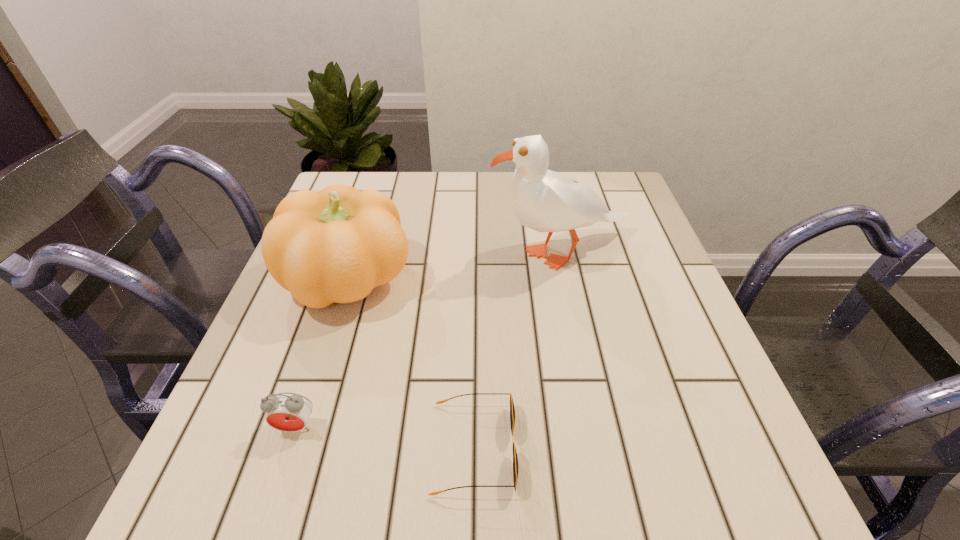
Where is `pumpkin situated at the left edge`? The width and height of the screenshot is (960, 540). pumpkin situated at the left edge is located at coordinates (336, 245).

Identify the location of alarm clock that is at the left edge. (289, 412).

The image size is (960, 540). Find the location of `object located in the right edge section of the desktop`. object located in the right edge section of the desktop is located at coordinates (543, 200).

Image resolution: width=960 pixels, height=540 pixels. I want to click on vacant space at the far edge of the desktop, so click(x=440, y=207).

The width and height of the screenshot is (960, 540). I want to click on vacant space at the near edge of the desktop, so click(500, 489).

I want to click on vacant space at the right edge, so click(660, 385).

Locate an element on the screen. This screenshot has height=540, width=960. free space at the far left corner of the desktop is located at coordinates (373, 184).

This screenshot has width=960, height=540. Find the location of `vacant space at the far right corner of the desktop`. vacant space at the far right corner of the desktop is located at coordinates (605, 171).

The image size is (960, 540). I want to click on vacant space at the near right corner of the desktop, so click(x=762, y=498).

The image size is (960, 540). What are the coordinates of `vacant space that's between the third tallest object and the gull` in the screenshot? It's located at (428, 340).